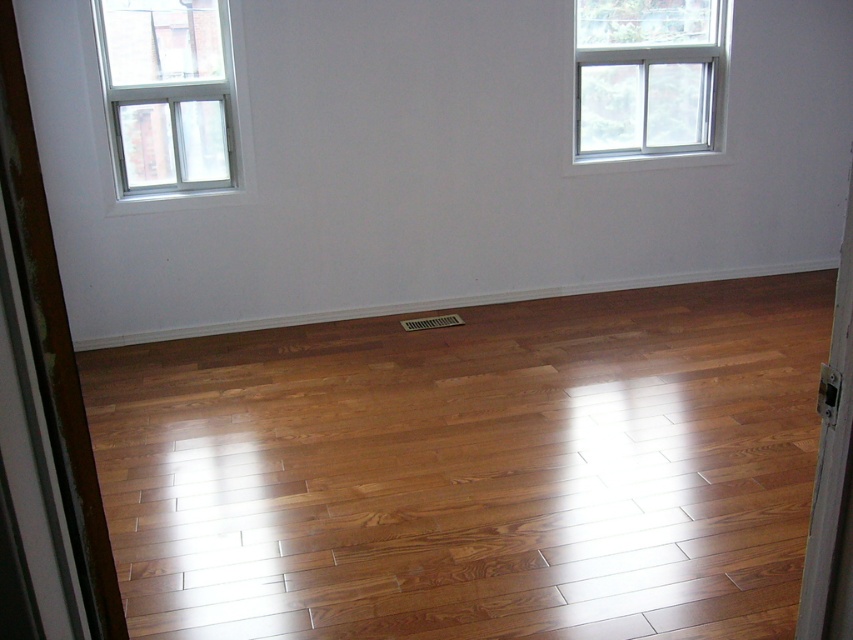
Question: Estimate the real-world distances between objects in this image. Which object is farther from the white plastic window at upper right?

Choices:
 (A) shiny brown wood floor at center
 (B) white plastic window at upper left

Answer: (B)

Question: Is white plastic window at upper left thinner than white plastic window at upper right?

Choices:
 (A) yes
 (B) no

Answer: (A)

Question: Considering the relative positions of shiny brown wood floor at center and white plastic window at upper right in the image provided, where is shiny brown wood floor at center located with respect to white plastic window at upper right?

Choices:
 (A) left
 (B) right

Answer: (A)

Question: Considering the real-world distances, which object is farthest from the shiny brown wood floor at center?

Choices:
 (A) white plastic window at upper left
 (B) white plastic window at upper right

Answer: (B)

Question: In this image, where is shiny brown wood floor at center located relative to white plastic window at upper right?

Choices:
 (A) right
 (B) left

Answer: (B)

Question: Which of the following is the closest to the observer?

Choices:
 (A) white plastic window at upper right
 (B) shiny brown wood floor at center
 (C) white plastic window at upper left

Answer: (B)